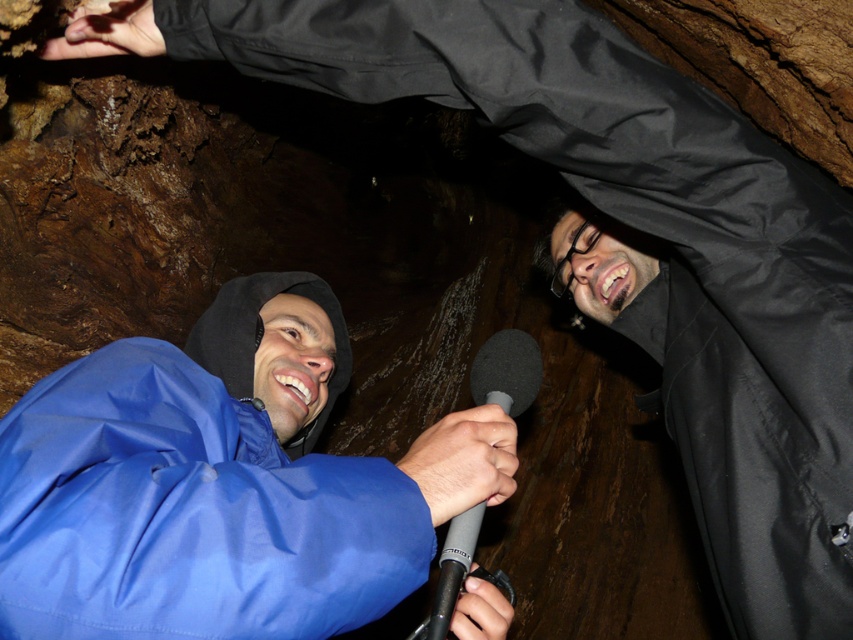
Who is more distant from viewer, (267, 452) or (488, 385)?

Positioned behind is point (267, 452).

Is point (59, 451) positioned before point (490, 358)?

Yes, point (59, 451) is closer to viewer.

Find the location of a particular element. The width and height of the screenshot is (853, 640). blue waterproof jacket at center is located at coordinates (219, 484).